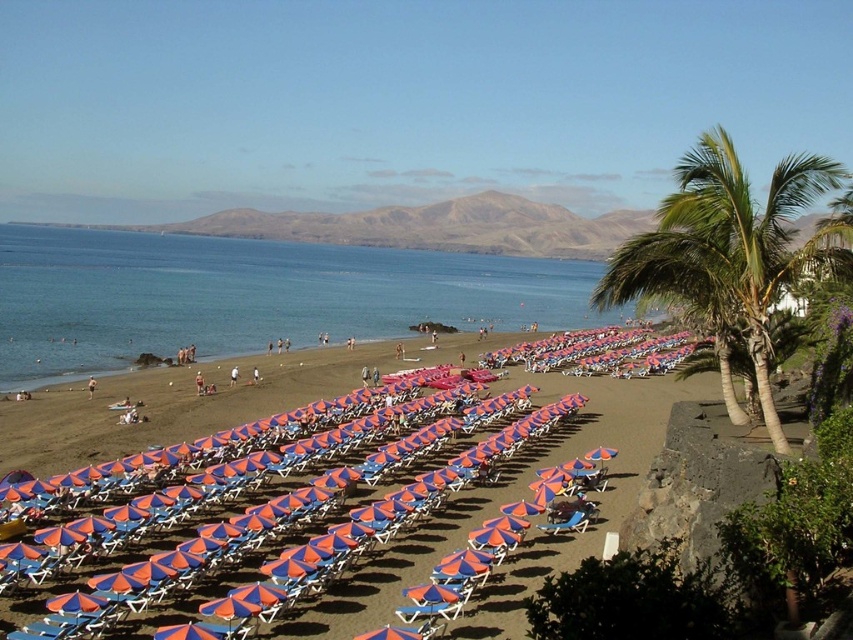
Is blue water at left thinner than green leafy palm tree at right?

No.

Is blue water at left smaller than green leafy palm tree at right?

Actually, blue water at left might be larger than green leafy palm tree at right.

Which is behind, point (502, 288) or point (827, 244)?

The point (502, 288) is behind.

The width and height of the screenshot is (853, 640). What are the coordinates of `blue water at left` in the screenshot? It's located at (251, 296).

Find the location of a particular element. The height and width of the screenshot is (640, 853). green leafy palm tree at right is located at coordinates (727, 248).

Which of these two, green leafy palm tree at right or blue fabric beach chair at center, stands taller?

green leafy palm tree at right is taller.

This screenshot has height=640, width=853. In order to click on green leafy palm tree at right in this screenshot , I will do `click(727, 248)`.

This screenshot has width=853, height=640. In order to click on green leafy palm tree at right in this screenshot , I will do `click(727, 248)`.

Consider the image. Can you confirm if blue water at left is positioned below blue fabric beach chair at center?

No, blue water at left is not below blue fabric beach chair at center.

Does blue water at left have a greater height compared to blue fabric beach chair at center?

Correct, blue water at left is much taller as blue fabric beach chair at center.

Between point (206, 316) and point (561, 520), which one is positioned behind?

The point (206, 316) is behind.

Locate an element on the screen. This screenshot has height=640, width=853. blue water at left is located at coordinates (251, 296).